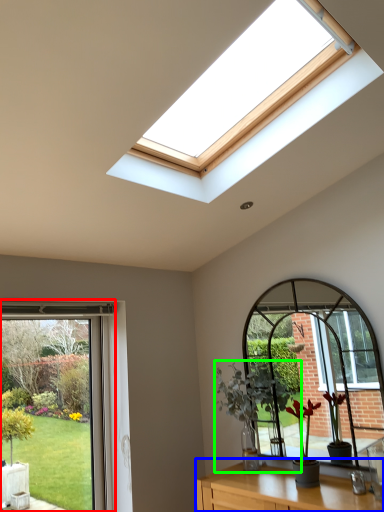
Question: Which is farther away from window (highlighted by a red box)? table (highlighted by a blue box) or houseplant (highlighted by a green box)?

Choices:
 (A) table
 (B) houseplant

Answer: (A)